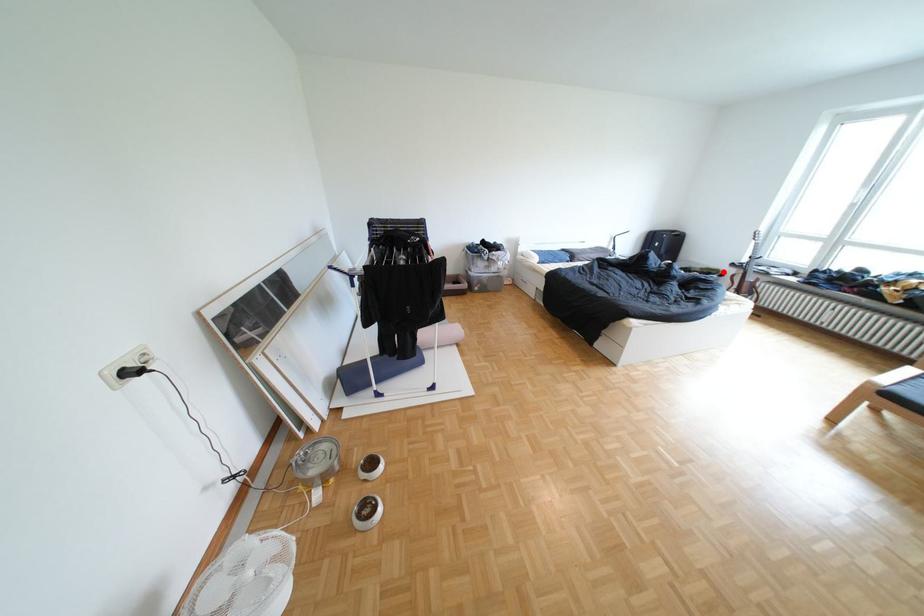
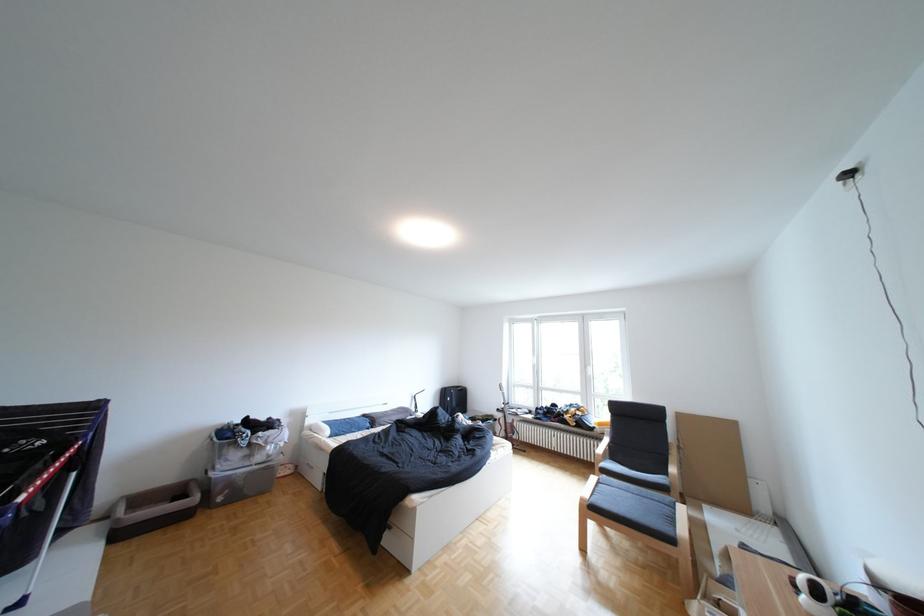
Where in the second image is the point corresponding to the highlighted location from the first image?

(502, 419)